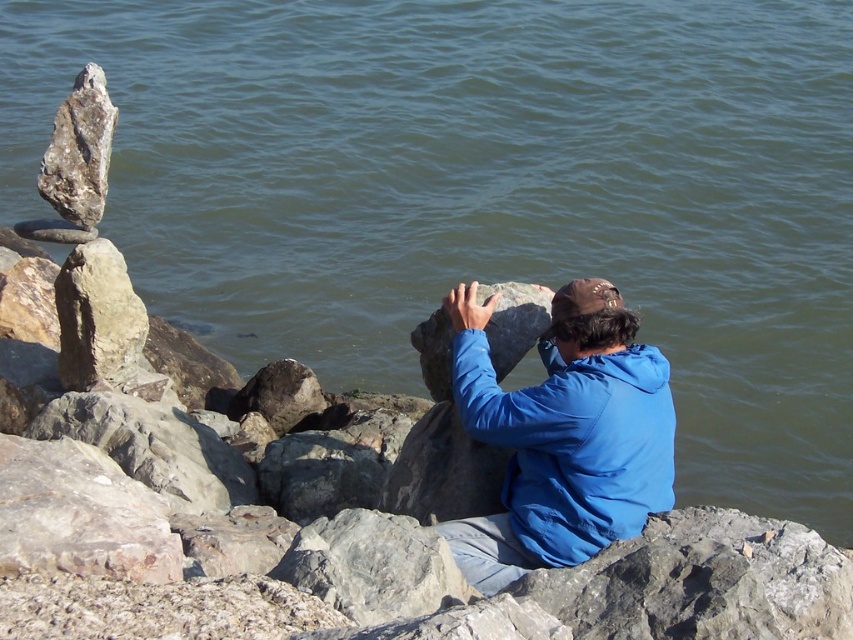
Is gray rough rock at center bigger than smooth gray rock at center?

Indeed, gray rough rock at center has a larger size compared to smooth gray rock at center.

Which is more to the left, gray rough rock at center or smooth gray rock at center?

gray rough rock at center

Does point (386, 609) come farther from viewer compared to point (439, 317)?

No, it is not.

Where is `gray rough rock at center`? The image size is (853, 640). gray rough rock at center is located at coordinates (373, 566).

Does blue fabric jacket at center have a larger size compared to gray rough rock at center?

Yes, blue fabric jacket at center is bigger than gray rough rock at center.

Is point (631, 381) positioned after point (351, 611)?

Yes.

What do you see at coordinates (561, 435) in the screenshot?
I see `blue fabric jacket at center` at bounding box center [561, 435].

Locate an element on the screen. The height and width of the screenshot is (640, 853). blue fabric jacket at center is located at coordinates (561, 435).

Is blue fabric jacket at center taller than smooth gray rock at center?

Yes.

Is point (653, 397) positioned after point (500, 355)?

No.

Where is `blue fabric jacket at center`? This screenshot has height=640, width=853. blue fabric jacket at center is located at coordinates (561, 435).